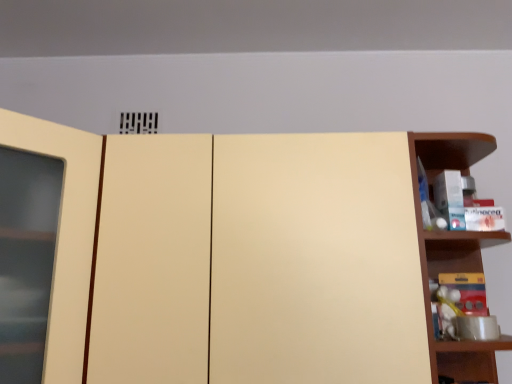
Locate an element on the screen. wooden shelf at right is located at coordinates (429, 306).

The height and width of the screenshot is (384, 512). What do you see at coordinates (237, 256) in the screenshot?
I see `matte cream cupboard at center` at bounding box center [237, 256].

Identify the location of wooden shelf at right. (429, 306).

Is wooden shelf at right not inside matte cream cupboard at center?

Yes, wooden shelf at right is outside of matte cream cupboard at center.

Is wooden shelf at right oriented towards matte cream cupboard at center?

No, wooden shelf at right does not turn towards matte cream cupboard at center.

Which of these two, wooden shelf at right or matte cream cupboard at center, is smaller?

Smaller between the two is wooden shelf at right.

From a real-world perspective, between wooden shelf at right and matte cream cupboard at center, who is vertically lower?

In real-world perspective, matte cream cupboard at center is lower.

From the image's perspective, is matte cream cupboard at center positioned above or below matte yellow toy at right?

Clearly, from the image's perspective, matte cream cupboard at center is above matte yellow toy at right.

At what (x,y) coordinates should I click in order to perform the action: click on toy on the right of matte cream cupboard at center. Please return your answer as a coordinate pair (x, y). This screenshot has width=512, height=384. Looking at the image, I should click on (448, 310).

Is matte cream cupboard at center beside matte yellow toy at right?

matte cream cupboard at center is not next to matte yellow toy at right, and they're not touching.

Between point (270, 329) and point (437, 307), which one is positioned behind?

The point (437, 307) is behind.

Are matte yellow toy at right and wooden shelf at right located far from each other?

They are positioned close to each other.

Between matte yellow toy at right and wooden shelf at right, which one has larger width?

wooden shelf at right.

From the image's perspective, does matte yellow toy at right appear lower than wooden shelf at right?

Yes, from the image's perspective, matte yellow toy at right is below wooden shelf at right.

Considering the relative sizes of wooden shelf at right and matte yellow toy at right in the image provided, is wooden shelf at right taller than matte yellow toy at right?

Yes, wooden shelf at right is taller than matte yellow toy at right.

Locate an element on the screen. shelf in front of the matte yellow toy at right is located at coordinates (429, 306).

Considering the sizes of objects wooden shelf at right and matte yellow toy at right in the image provided, who is wider, wooden shelf at right or matte yellow toy at right?

Wider between the two is wooden shelf at right.

Would you say wooden shelf at right contains matte yellow toy at right?

Indeed, matte yellow toy at right is located within wooden shelf at right.

Between matte cream cupboard at center and wooden shelf at right, which one has more height?

With more height is matte cream cupboard at center.

How many degrees apart are the facing directions of matte cream cupboard at center and wooden shelf at right?

The angle between the facing direction of matte cream cupboard at center and the facing direction of wooden shelf at right is 0.000798 degrees.

Considering the relative sizes of matte cream cupboard at center and wooden shelf at right in the image provided, is matte cream cupboard at center wider than wooden shelf at right?

Answer: Correct, the width of matte cream cupboard at center exceeds that of wooden shelf at right.

Considering the positions of objects matte cream cupboard at center and wooden shelf at right in the image provided, who is more to the left, matte cream cupboard at center or wooden shelf at right?

matte cream cupboard at center is more to the left.

Which is more to the right, matte yellow toy at right or matte cream cupboard at center?

From the viewer's perspective, matte yellow toy at right appears more on the right side.

Which is nearer, (452, 309) or (354, 248)?

Clearly, point (452, 309) is more distant from the camera than point (354, 248).

Between matte yellow toy at right and matte cream cupboard at center, which one has less height?

matte yellow toy at right is shorter.

Would you say matte yellow toy at right contains matte cream cupboard at center?

No, matte cream cupboard at center is not a part of matte yellow toy at right.

Where is `cupboard that is in front of the wooden shelf at right`? This screenshot has height=384, width=512. cupboard that is in front of the wooden shelf at right is located at coordinates (237, 256).

Where is `toy below the matte cream cupboard at center (from the image's perspective)`? The image size is (512, 384). toy below the matte cream cupboard at center (from the image's perspective) is located at coordinates (448, 310).

Estimate the real-world distances between objects in this image. Which object is closer to wooden shelf at right, matte cream cupboard at center or matte yellow toy at right?

The object closer to wooden shelf at right is matte yellow toy at right.

Which object lies further to the anchor point wooden shelf at right, matte yellow toy at right or matte cream cupboard at center?

matte cream cupboard at center is positioned further to the anchor wooden shelf at right.

Estimate the real-world distances between objects in this image. Which object is closer to matte yellow toy at right, wooden shelf at right or matte cream cupboard at center?

wooden shelf at right lies closer to matte yellow toy at right than the other object.

Considering their positions, is matte cream cupboard at center positioned further to matte yellow toy at right than wooden shelf at right?

matte cream cupboard at center is positioned further to the anchor matte yellow toy at right.

Looking at the image, which one is located further to matte cream cupboard at center, wooden shelf at right or matte yellow toy at right?

Based on the image, matte yellow toy at right appears to be further to matte cream cupboard at center.

Based on their spatial positions, is matte yellow toy at right or wooden shelf at right further from matte cream cupboard at center?

Based on the image, matte yellow toy at right appears to be further to matte cream cupboard at center.

Image resolution: width=512 pixels, height=384 pixels. Find the location of `toy between matte cream cupboard at center and wooden shelf at right`. toy between matte cream cupboard at center and wooden shelf at right is located at coordinates (448, 310).